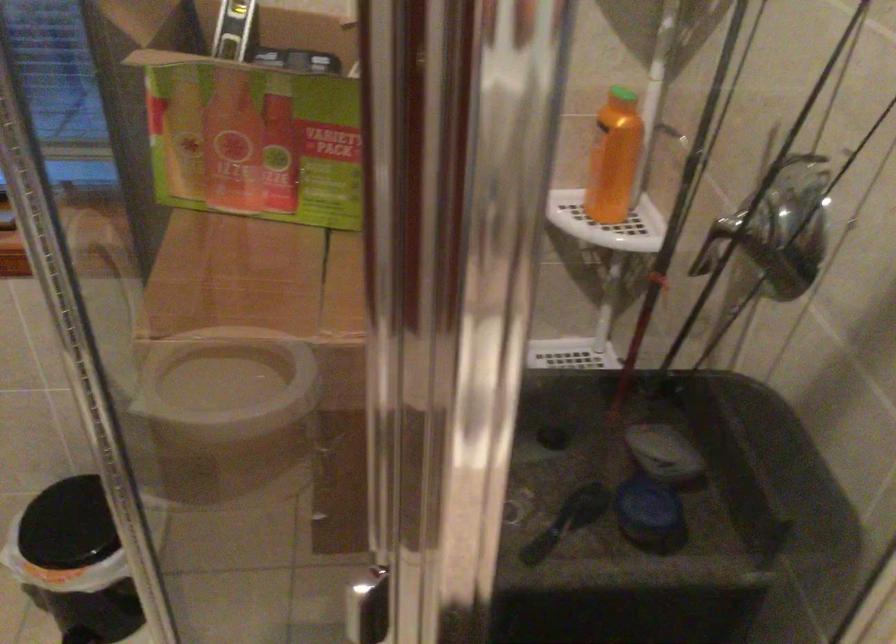
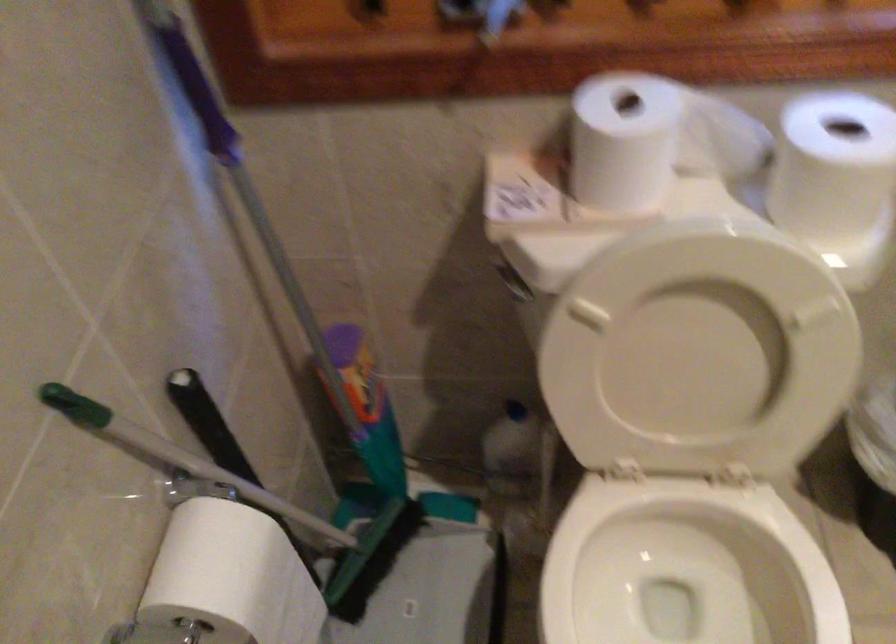
Question: In a continuous first-person perspective shot, in which direction is the camera moving?

Choices:
 (A) Left
 (B) Right
 (C) Forward
 (D) Backward

Answer: (A)